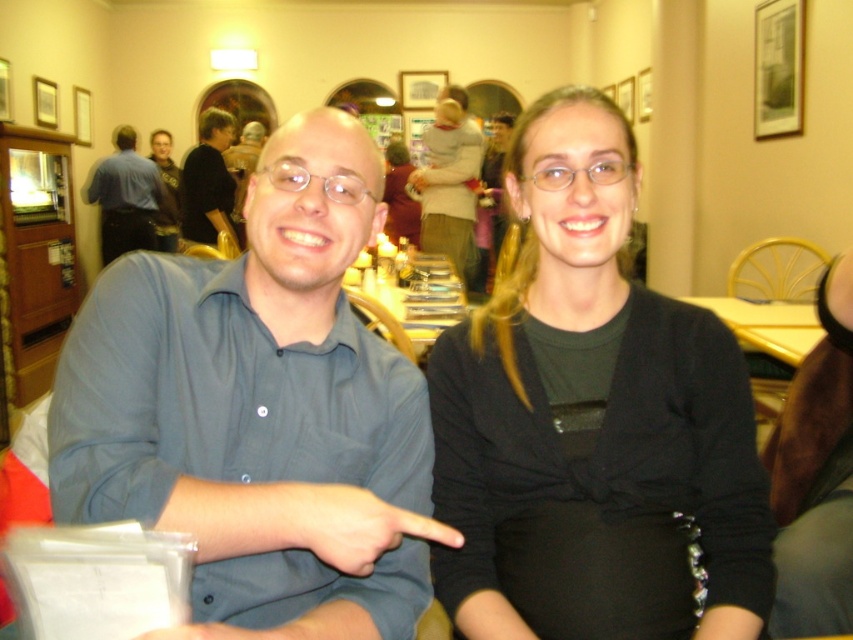
You are standing at the origin of the coordinate system in the image. There are two points marked in the scene, one at point (x=80, y=192) and the other at point (x=227, y=128). Which point is closer to you?

Point (x=227, y=128) is closer to you because it is in front of point (x=80, y=192) according to their positions in the coordinate system.